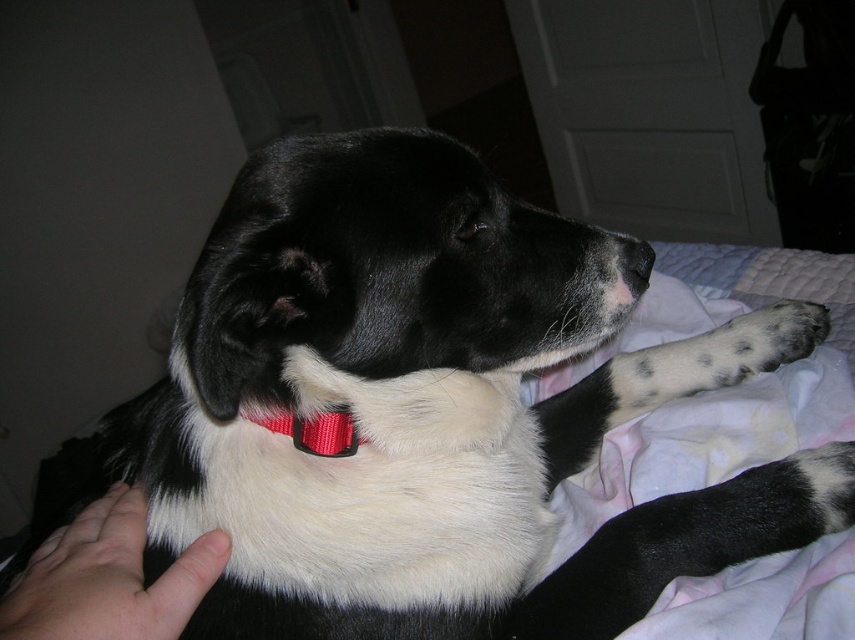
From the picture: Does red nylon collar at center appear on the left side of black matte nose at center?

Yes, red nylon collar at center is to the left of black matte nose at center.

Does red nylon collar at center appear over black matte nose at center?

No.

Where is `red nylon collar at center`? This screenshot has width=855, height=640. red nylon collar at center is located at coordinates (315, 432).

Does soft skin hand at lower left appear over red nylon collar at center?

Actually, soft skin hand at lower left is below red nylon collar at center.

Is soft skin hand at lower left in front of red nylon collar at center?

Yes, soft skin hand at lower left is in front of red nylon collar at center.

Between point (91, 509) and point (269, 422), which one is positioned behind?

The point (91, 509) is more distant.

Identify the location of soft skin hand at lower left. Image resolution: width=855 pixels, height=640 pixels. (108, 579).

The image size is (855, 640). Describe the element at coordinates (108, 579) in the screenshot. I see `soft skin hand at lower left` at that location.

Does soft skin hand at lower left have a greater width compared to black matte nose at center?

Indeed, soft skin hand at lower left has a greater width compared to black matte nose at center.

What do you see at coordinates (108, 579) in the screenshot? The image size is (855, 640). I see `soft skin hand at lower left` at bounding box center [108, 579].

Locate an element on the screen. This screenshot has width=855, height=640. soft skin hand at lower left is located at coordinates (108, 579).